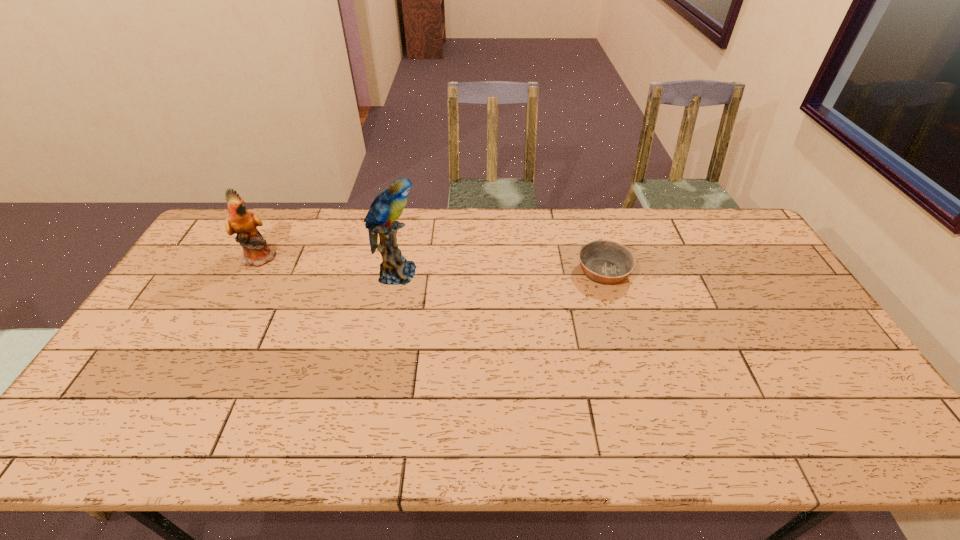
The height and width of the screenshot is (540, 960). I want to click on free location at the far edge of the desktop, so click(x=575, y=241).

At what (x,y) coordinates should I click in order to perform the action: click on vacant space at the near edge of the desktop. Please return your answer as a coordinate pair (x, y). Image resolution: width=960 pixels, height=540 pixels. Looking at the image, I should click on (164, 450).

Locate an element on the screen. This screenshot has height=540, width=960. vacant space at the left edge is located at coordinates (229, 266).

The image size is (960, 540). Identify the location of vacant position at the right edge of the desktop. (783, 332).

Locate an element on the screen. free space at the near right corner of the desktop is located at coordinates (880, 448).

This screenshot has height=540, width=960. In order to click on vacant area that lies between the shorter parrot and the shortest object in this screenshot , I will do `click(432, 265)`.

At what (x,y) coordinates should I click in order to perform the action: click on vacant space that is in between the tallest object and the leftmost object. Please return your answer as a coordinate pair (x, y). The height and width of the screenshot is (540, 960). Looking at the image, I should click on (329, 265).

The height and width of the screenshot is (540, 960). In order to click on vacant space that's between the shorter parrot and the rightmost object in this screenshot , I will do `click(432, 265)`.

Identify the location of vacant area between the right parrot and the leftmost object. This screenshot has width=960, height=540. (329, 265).

At what (x,y) coordinates should I click in order to perform the action: click on free space between the second object from right to left and the second tallest object. Please return your answer as a coordinate pair (x, y). This screenshot has width=960, height=540. Looking at the image, I should click on (x=329, y=265).